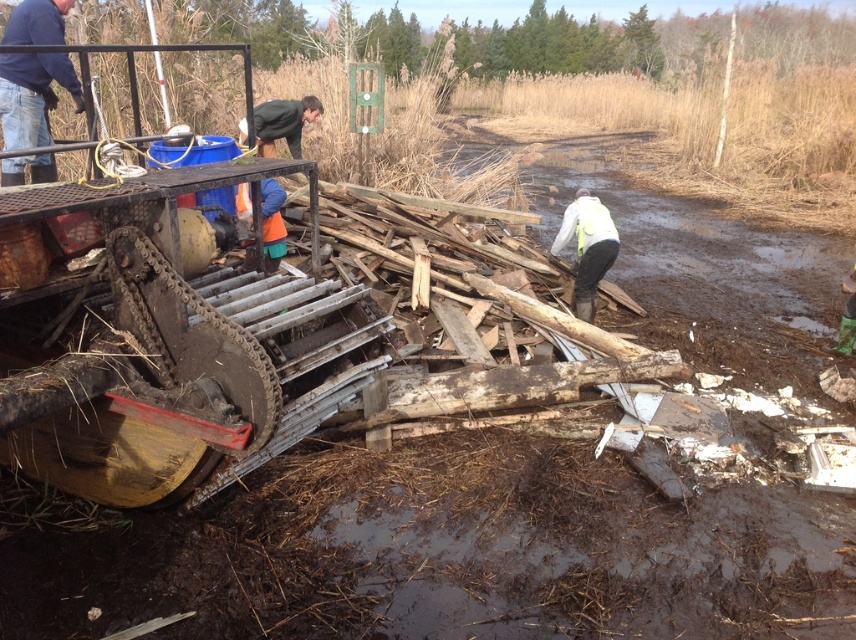
Is point (58, 65) closer to camera compared to point (284, 140)?

Yes, it is.

Between blue denim jeans at upper left and green matte jacket at upper center, which one appears on the left side from the viewer's perspective?

blue denim jeans at upper left is more to the left.

Does point (46, 129) come farther from viewer compared to point (270, 125)?

No, (46, 129) is closer to viewer.

This screenshot has width=856, height=640. What are the coordinates of `blue denim jeans at upper left` in the screenshot? It's located at (33, 93).

Can you confirm if blue denim jeans at upper left is shorter than white matte jacket at center?

No.

Does blue denim jeans at upper left have a smaller size compared to white matte jacket at center?

Actually, blue denim jeans at upper left might be larger than white matte jacket at center.

The height and width of the screenshot is (640, 856). What do you see at coordinates (33, 93) in the screenshot? I see `blue denim jeans at upper left` at bounding box center [33, 93].

Where is `blue denim jeans at upper left`? blue denim jeans at upper left is located at coordinates (33, 93).

Where is `white matte jacket at center`? This screenshot has height=640, width=856. white matte jacket at center is located at coordinates (587, 248).

Is white matte jacket at center wider than green matte jacket at upper center?

In fact, white matte jacket at center might be narrower than green matte jacket at upper center.

Measure the distance between point [607,211] and camera.

The distance of point [607,211] from camera is 23.20 feet.

The width and height of the screenshot is (856, 640). I want to click on white matte jacket at center, so click(x=587, y=248).